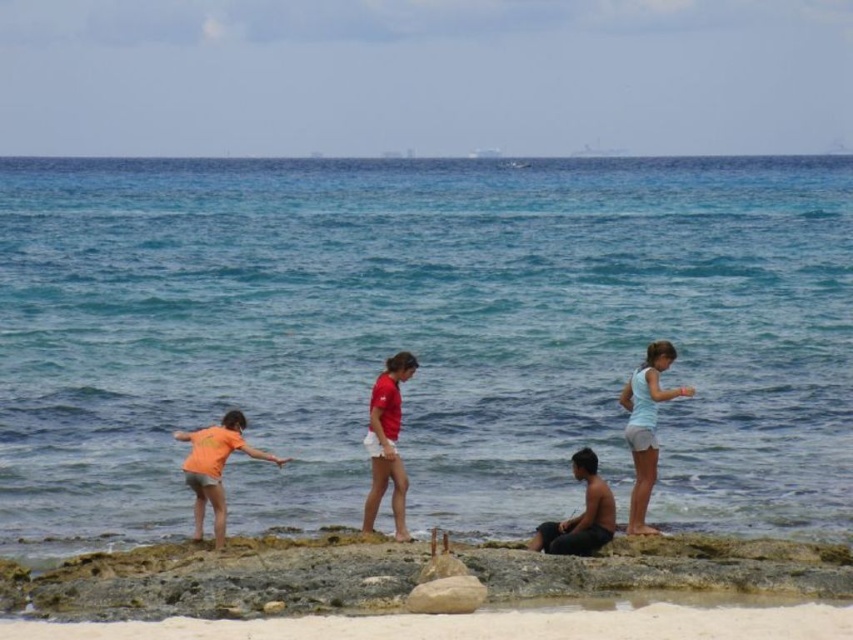
Who is shorter, matte red shirt at center or orange cotton shirt at lower left?

orange cotton shirt at lower left is shorter.

Does matte red shirt at center appear on the right side of orange cotton shirt at lower left?

Correct, you'll find matte red shirt at center to the right of orange cotton shirt at lower left.

Which is behind, point (376, 492) or point (202, 502)?

Point (202, 502)

This screenshot has height=640, width=853. In order to click on matte red shirt at center in this screenshot , I will do `click(387, 442)`.

Can you confirm if shiny black shorts at lower center is positioned to the left of smooth gray rock at center?

No, shiny black shorts at lower center is not to the left of smooth gray rock at center.

Describe the element at coordinates (579, 515) in the screenshot. This screenshot has width=853, height=640. I see `shiny black shorts at lower center` at that location.

Is point (575, 458) farther from viewer compared to point (479, 602)?

Yes, it is behind point (479, 602).

Where is `shiny black shorts at lower center`? shiny black shorts at lower center is located at coordinates (579, 515).

Is light blue denim shorts at right thinner than matte red shirt at center?

Yes, light blue denim shorts at right is thinner than matte red shirt at center.

Is light blue denim shorts at right above matte red shirt at center?

Yes.

Locate an element on the screen. The width and height of the screenshot is (853, 640). light blue denim shorts at right is located at coordinates (646, 426).